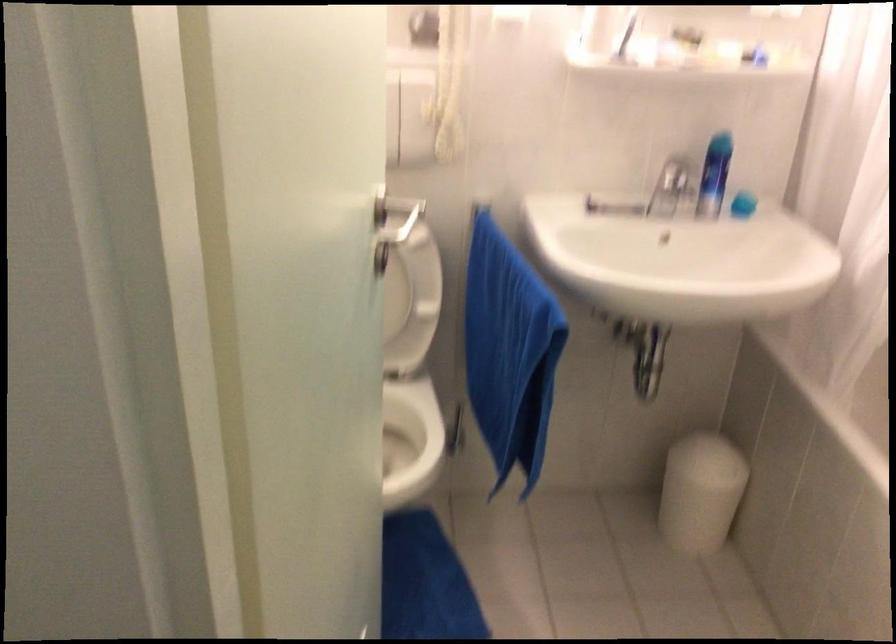
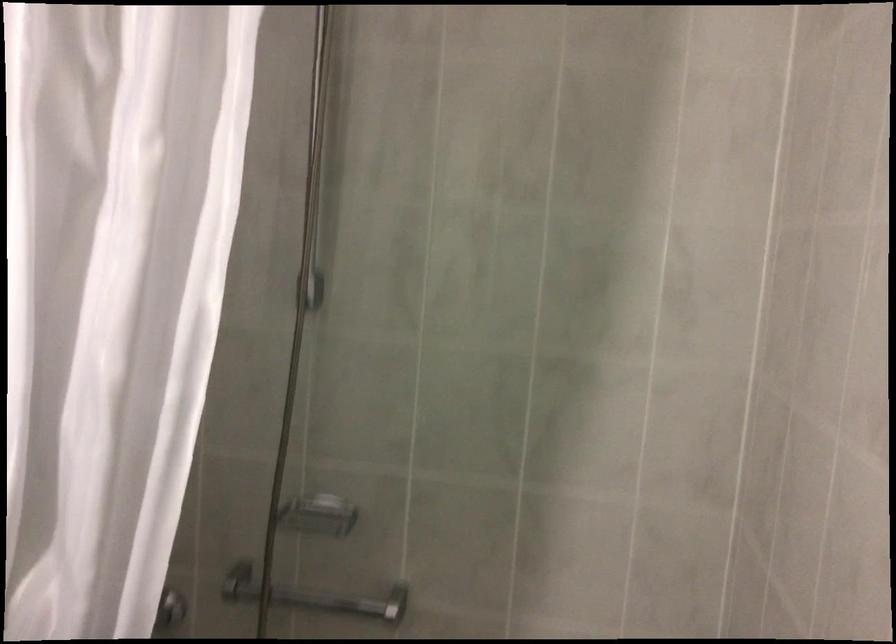
Question: The images are taken continuously from a first-person perspective. In which direction is your viewpoint rotating?

Choices:
 (A) Left
 (B) Right
 (C) Up
 (D) Down

Answer: (B)